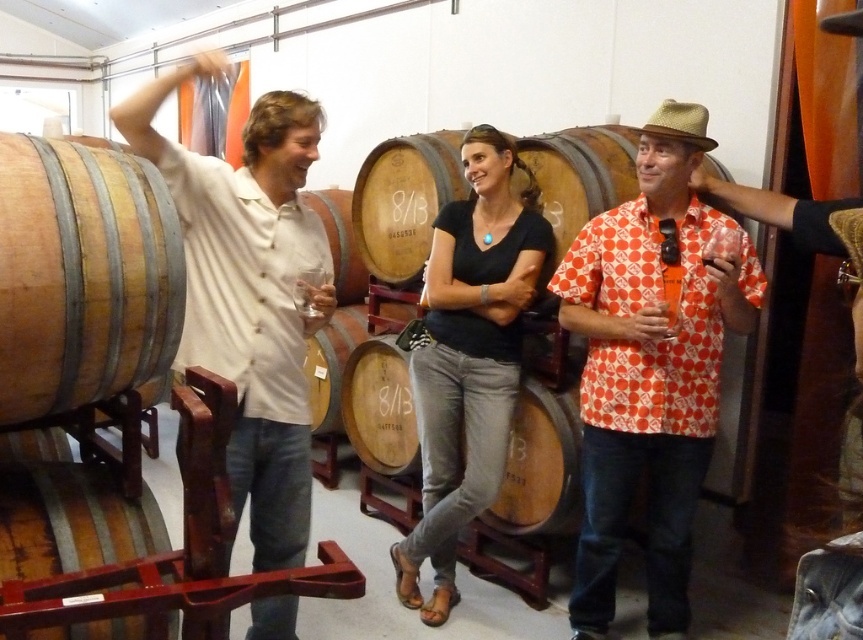
You are a photographer positioned at the back of the room. You want to take a photo of both the orange dotted shirt at center and the light beige shirt at left. Which one should you focus on first to ensure both are in focus?

You should focus on the light beige shirt at left first because it is closer to you than the orange dotted shirt at center, which is further away. By focusing on the closer subject, you can ensure the depth of field captures both in focus.

You are standing in the winery scene and want to move from point A at coordinates point [719,268] to point B at coordinates point [281,324]. Will you be moving towards the background or the foreground?

Moving from point A at coordinates point [719,268] to point B at coordinates point [281,324] means you are moving towards the foreground because point A is further to the viewer than point B.